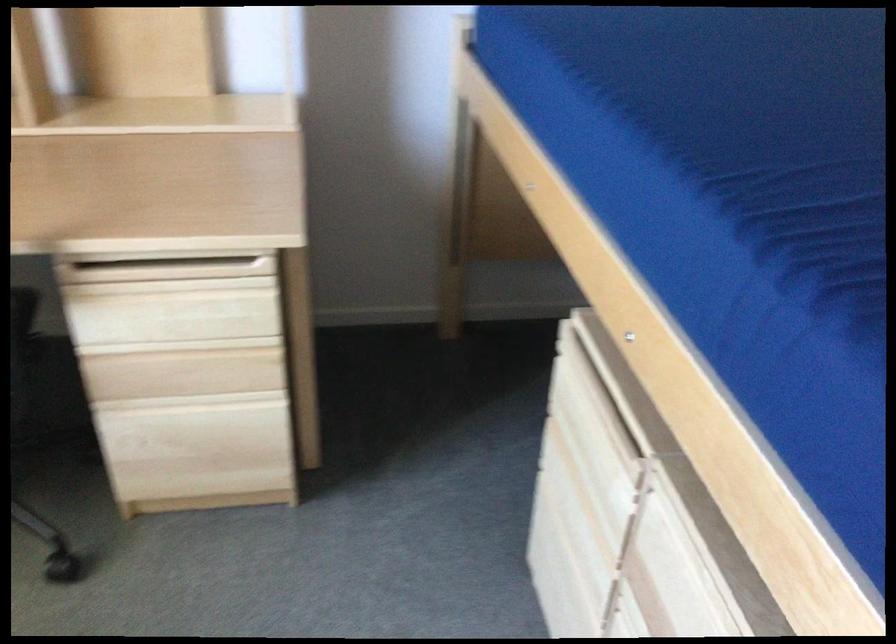
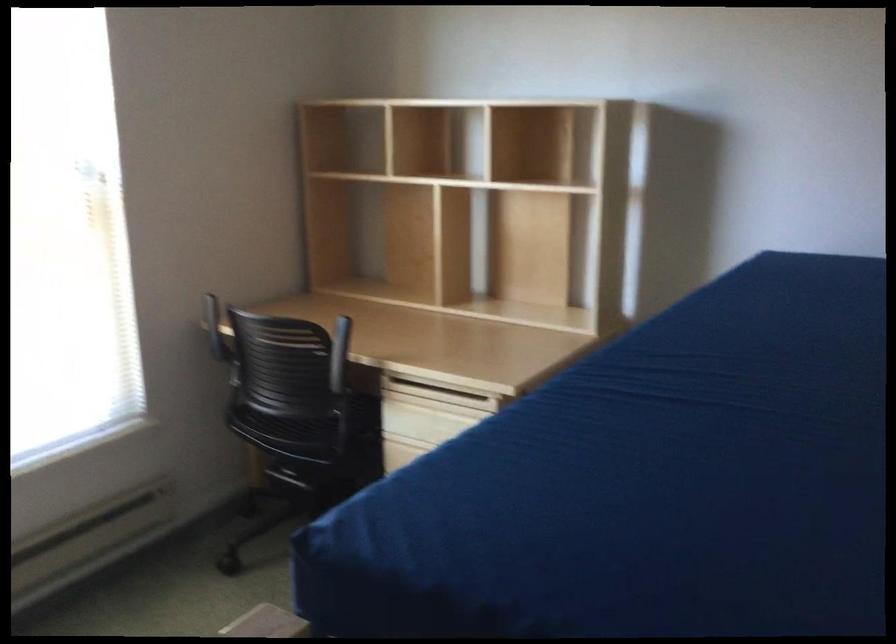
Question: I am providing you with two images of the same scene from different viewpoints. Please identify which objects are invisible in image2.

Choices:
 (A) light wood drawer handle
 (B) black chair armrest
 (C) green detergent box
 (D) black chair sitting surface

Answer: (A)